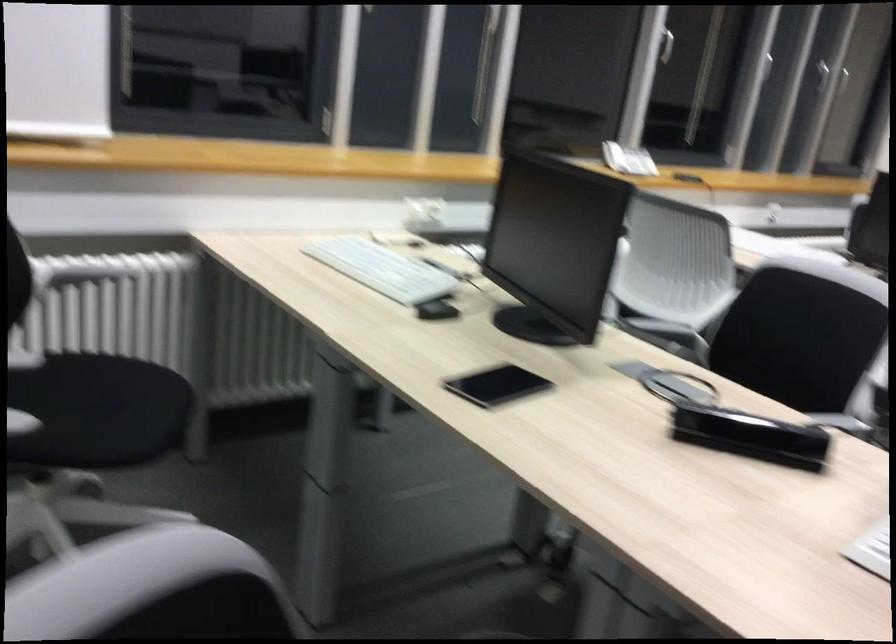
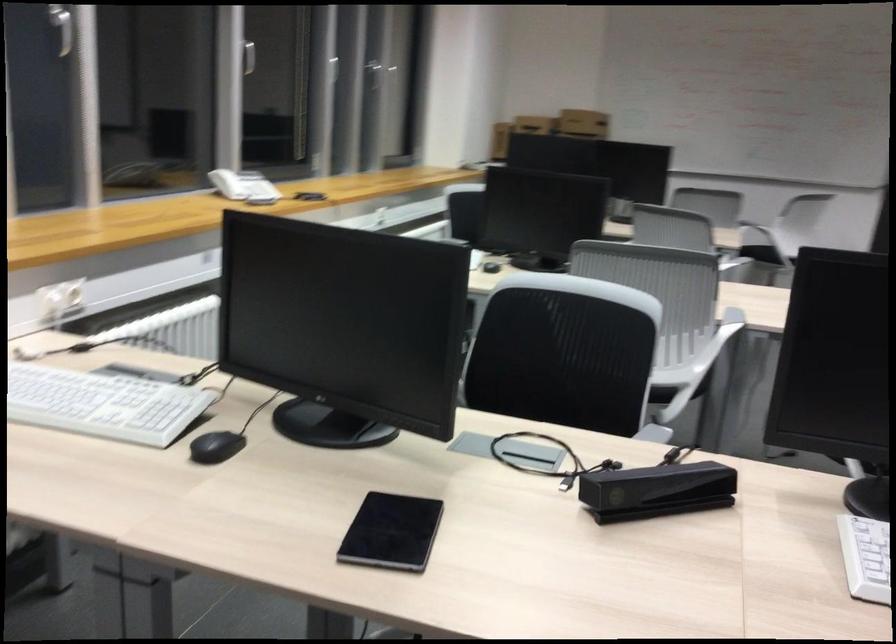
Question: The first image is from the beginning of the video and the second image is from the end. How did the camera likely rotate when shooting the video?

Choices:
 (A) Left
 (B) Right
 (C) Up
 (D) Down

Answer: (B)